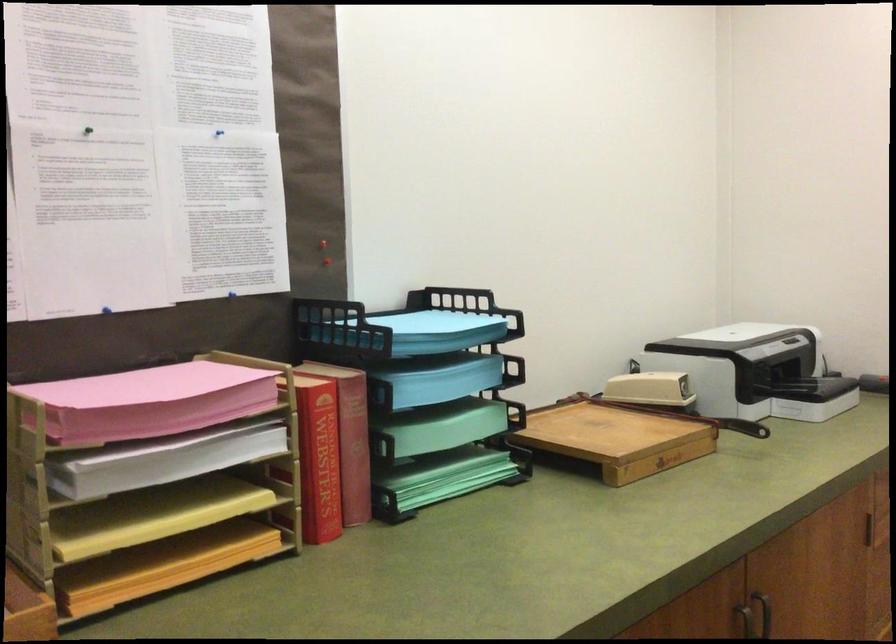
At what (x,y) coordinates should I click in order to perform the action: click on red Webster's book. Please return your answer as a coordinate pair (x, y). The width and height of the screenshot is (896, 644). Looking at the image, I should click on click(319, 456).